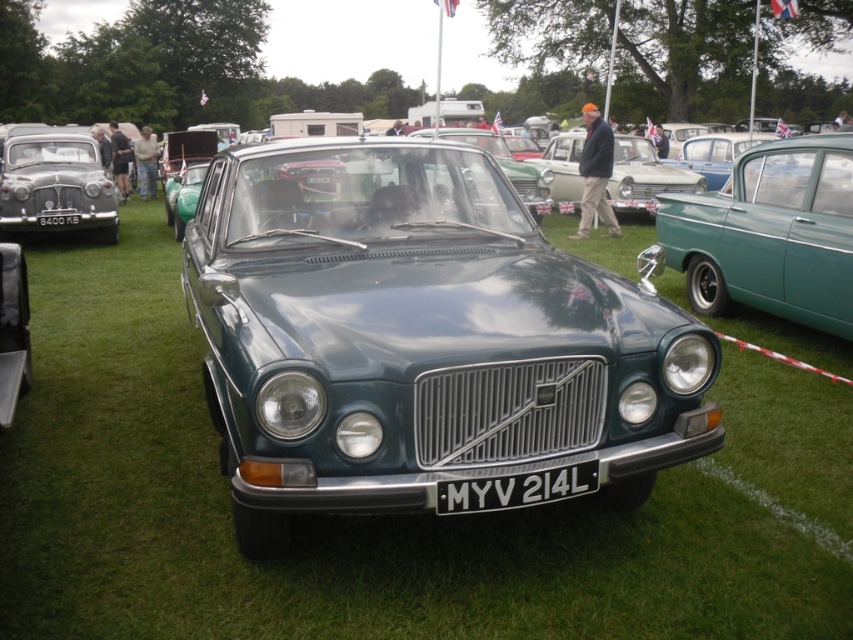
What is located at the coordinate point (55, 186) in the image?

At point (55, 186) lies the matte silver car at left.